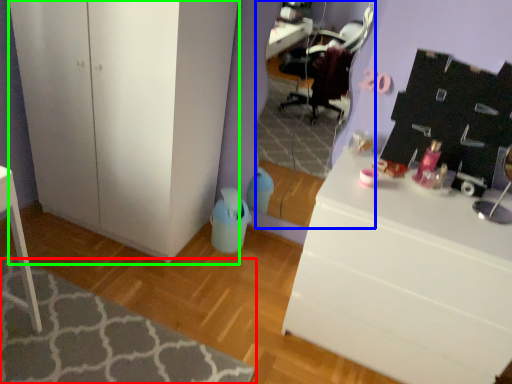
Question: Which object is positioned farthest from mat (highlighted by a red box)? Select from mirror (highlighted by a blue box) and cabinetry (highlighted by a green box).

Choices:
 (A) mirror
 (B) cabinetry

Answer: (A)